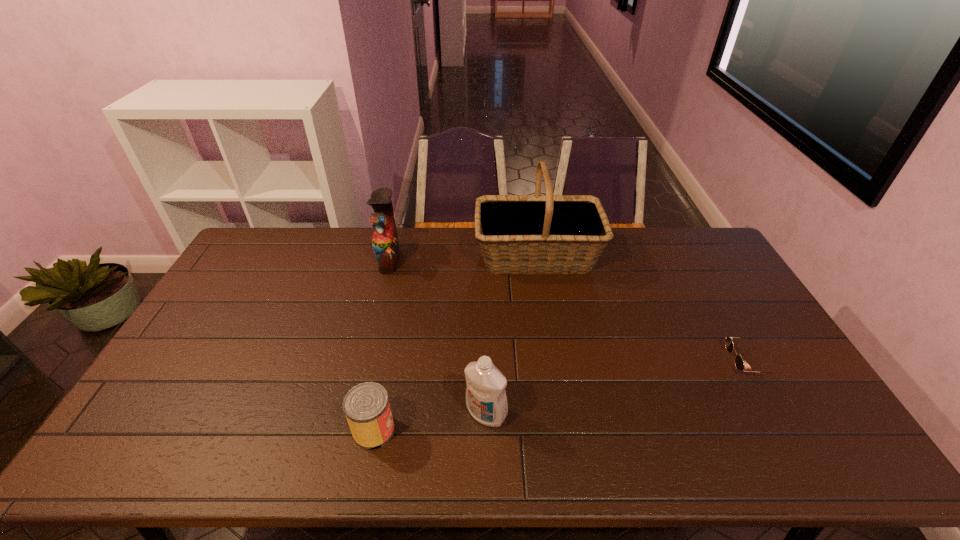
Locate an element on the screen. This screenshot has width=960, height=540. the tallest object is located at coordinates (518, 234).

Find the location of a particular element. This screenshot has height=540, width=960. parrot is located at coordinates (385, 243).

This screenshot has width=960, height=540. Identify the location of detergent. (486, 400).

Where is `can`? This screenshot has width=960, height=540. can is located at coordinates point(366,406).

In order to click on the third nearest object in this screenshot , I will do `click(739, 363)`.

Find the location of `the shortest object`. the shortest object is located at coordinates (739, 363).

Where is `vacant space located by the handle of the tallest object`? This screenshot has height=540, width=960. vacant space located by the handle of the tallest object is located at coordinates (420, 256).

At what (x,y) coordinates should I click in order to perform the action: click on vacant point located 0.350m by the handle of the tallest object. Please return your answer as a coordinate pair (x, y). Looking at the image, I should click on (379, 256).

This screenshot has height=540, width=960. Find the location of `free region located by the handle of the tallest object`. free region located by the handle of the tallest object is located at coordinates (443, 256).

At what (x,y) coordinates should I click in order to perform the action: click on blank space located 0.360m at the face of the parrot. Please return your answer as a coordinate pair (x, y). Looking at the image, I should click on (499, 259).